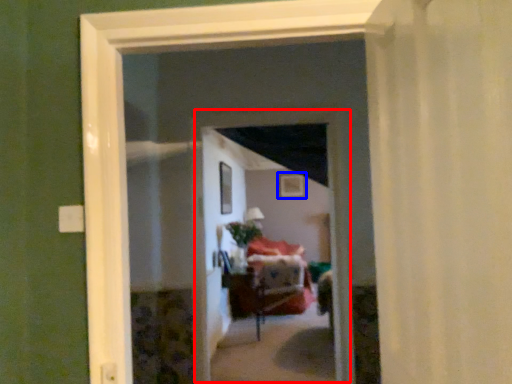
Question: Which object appears farthest to the camera in this image, screen door (highlighted by a red box) or picture frame (highlighted by a blue box)?

Choices:
 (A) screen door
 (B) picture frame

Answer: (B)